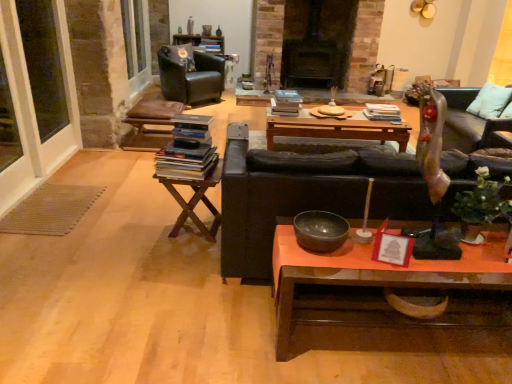
Question: Considering the relative positions of hardcover books at center, the 3th book ordered from the bottom, and wooden polished coffee table at lower center, which is the 1th coffee table from front to back, in the image provided, is hardcover books at center, the 3th book ordered from the bottom, to the right of wooden polished coffee table at lower center, which is the 1th coffee table from front to back, from the viewer's perspective?

Choices:
 (A) yes
 (B) no

Answer: (B)

Question: From a real-world perspective, is hardcover books at center, the 3th book ordered from the bottom, positioned over wooden polished coffee table at lower center, the 2th coffee table when ordered from top to bottom, based on gravity?

Choices:
 (A) no
 (B) yes

Answer: (B)

Question: Is hardcover books at center, the second book positioned from the back, completely or partially outside of wooden polished coffee table at lower center, the 2th coffee table when ordered from top to bottom?

Choices:
 (A) no
 (B) yes

Answer: (B)

Question: Can you confirm if hardcover books at center, the second book viewed from the front, is taller than wooden polished coffee table at lower center, the 2th coffee table when ordered from top to bottom?

Choices:
 (A) no
 (B) yes

Answer: (A)

Question: Is hardcover books at center, the second book positioned from the back, oriented towards wooden polished coffee table at lower center, the 1th coffee table ordered from the bottom?

Choices:
 (A) no
 (B) yes

Answer: (B)

Question: In the image, is matte red picture frame at center on the left side or the right side of matte black bowl at center?

Choices:
 (A) left
 (B) right

Answer: (B)

Question: From their relative heights in the image, would you say matte red picture frame at center is taller or shorter than matte black bowl at center?

Choices:
 (A) tall
 (B) short

Answer: (A)

Question: From a real-world perspective, is matte red picture frame at center above or below matte black bowl at center?

Choices:
 (A) below
 (B) above

Answer: (B)

Question: Considering the positions of matte red picture frame at center and matte black bowl at center in the image, is matte red picture frame at center bigger or smaller than matte black bowl at center?

Choices:
 (A) big
 (B) small

Answer: (B)

Question: From a real-world perspective, is wooden polished coffee table at lower center, marked as the second coffee table in a back-to-front arrangement, above or below matte black bowl at center?

Choices:
 (A) below
 (B) above

Answer: (A)

Question: Based on their positions, is wooden polished coffee table at lower center, which is the 1th coffee table from front to back, located to the left or right of matte black bowl at center?

Choices:
 (A) left
 (B) right

Answer: (B)

Question: Considering the positions of point (284, 355) and point (334, 220), is point (284, 355) closer or farther from the camera than point (334, 220)?

Choices:
 (A) closer
 (B) farther

Answer: (A)

Question: Looking at their shapes, would you say wooden polished coffee table at lower center, the 1th coffee table ordered from the bottom, is wider or thinner than matte black bowl at center?

Choices:
 (A) thin
 (B) wide

Answer: (B)

Question: Is woodenwoodentable at left to the left or to the right of matte red picture frame at center in the image?

Choices:
 (A) left
 (B) right

Answer: (A)

Question: Considering the positions of woodenwoodentable at left and matte red picture frame at center in the image, is woodenwoodentable at left bigger or smaller than matte red picture frame at center?

Choices:
 (A) small
 (B) big

Answer: (B)